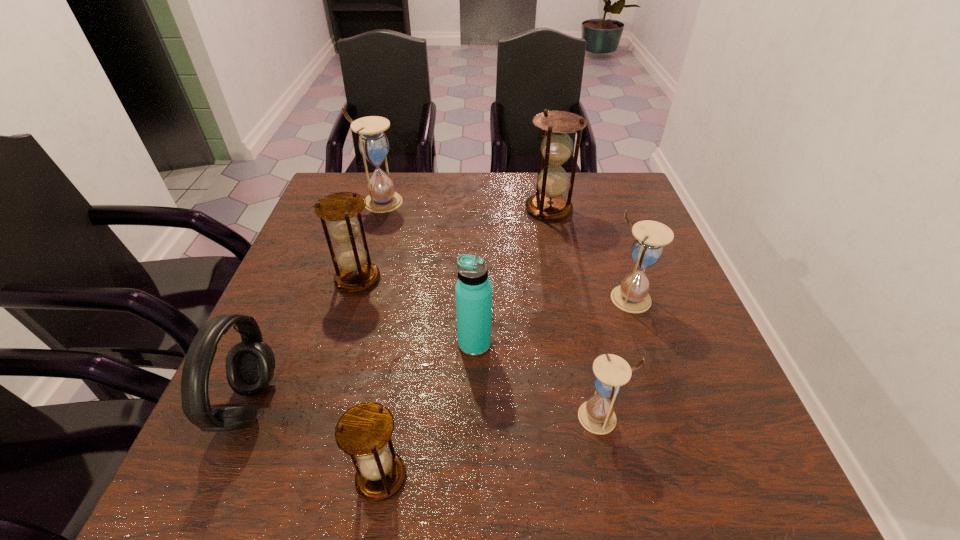
At what (x,y) coordinates should I click in order to perform the action: click on the biggest white hourglass. Please return your answer as a coordinate pair (x, y). Looking at the image, I should click on (373, 144).

This screenshot has height=540, width=960. In order to click on the farthest white hourglass in this screenshot , I will do `click(373, 144)`.

Where is `the farthest brown hourglass`? The width and height of the screenshot is (960, 540). the farthest brown hourglass is located at coordinates (556, 147).

Where is `the rightmost brown hourglass`? The height and width of the screenshot is (540, 960). the rightmost brown hourglass is located at coordinates (556, 147).

At what (x,y) coordinates should I click in order to perform the action: click on water bottle. Please return your answer as a coordinate pair (x, y). Looking at the image, I should click on (473, 290).

This screenshot has height=540, width=960. In order to click on the fifth farthest object in this screenshot , I will do `click(473, 290)`.

Find the location of `the second farthest brown hourglass`. the second farthest brown hourglass is located at coordinates (357, 273).

Image resolution: width=960 pixels, height=540 pixels. Identify the location of the second smallest brown hourglass. (357, 273).

The height and width of the screenshot is (540, 960). Find the location of `the rightmost white hourglass`. the rightmost white hourglass is located at coordinates (632, 296).

Where is `the second farthest white hourglass`? This screenshot has height=540, width=960. the second farthest white hourglass is located at coordinates (632, 296).